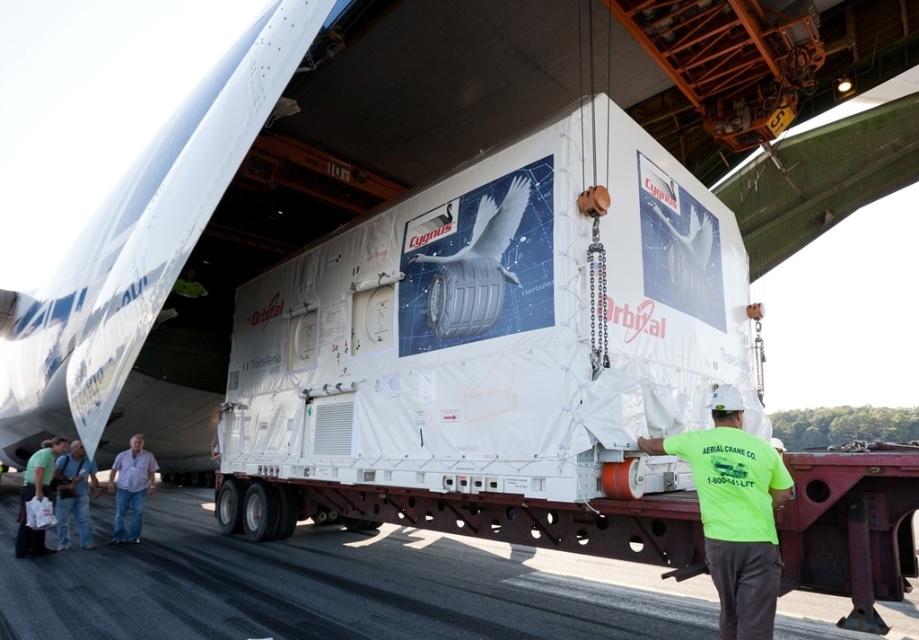
Is denim pants at lower left thinner than neon green t-shirt at lower left?

Yes, denim pants at lower left is thinner than neon green t-shirt at lower left.

Is denim pants at lower left bigger than neon green t-shirt at lower left?

No, denim pants at lower left is not bigger than neon green t-shirt at lower left.

What do you see at coordinates (74, 493) in the screenshot? I see `denim pants at lower left` at bounding box center [74, 493].

Where is `denim pants at lower left`? This screenshot has height=640, width=919. denim pants at lower left is located at coordinates (74, 493).

Can you confirm if denim jeans at lower left is bigger than neon green t-shirt at lower left?

Yes, denim jeans at lower left is bigger than neon green t-shirt at lower left.

Is denim jeans at lower left taller than neon green t-shirt at lower left?

Yes.

Who is more forward, (144, 456) or (44, 468)?

Point (44, 468)

This screenshot has height=640, width=919. In order to click on denim jeans at lower left in this screenshot , I will do `click(130, 486)`.

Does asphalt at lower center have a greater height compared to denim pants at lower left?

Yes, asphalt at lower center is taller than denim pants at lower left.

The width and height of the screenshot is (919, 640). In order to click on asphalt at lower center in this screenshot , I will do `click(330, 586)`.

This screenshot has height=640, width=919. What are the coordinates of `asphalt at lower center` in the screenshot? It's located at (330, 586).